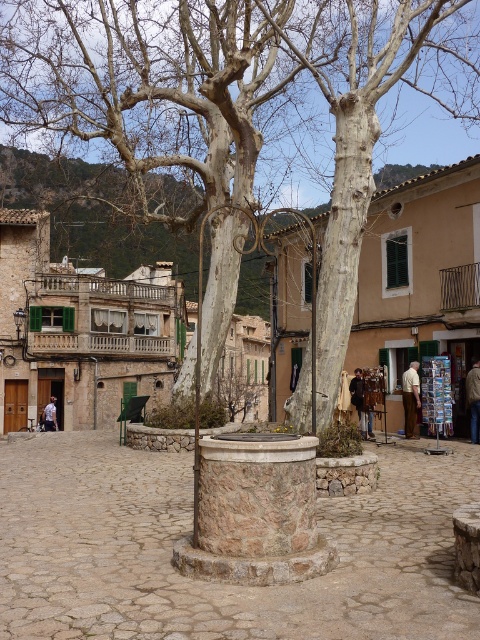
Question: Based on their relative distances, which object is nearer to the light blue denim jacket at center?

Choices:
 (A) brown leather jacket at center
 (B) smooth white tree at center

Answer: (B)

Question: Is smooth white tree at center to the left of smooth white bark at center from the viewer's perspective?

Choices:
 (A) yes
 (B) no

Answer: (A)

Question: Which object appears farthest from the camera in this image?

Choices:
 (A) smooth white bark at center
 (B) smooth white tree at center
 (C) brown leather jacket at center
 (D) dark brown leather jacket at center

Answer: (D)

Question: Which point is farther to the camera?

Choices:
 (A) (51, 406)
 (B) (362, 380)

Answer: (A)

Question: Can you confirm if smooth white bark at center is positioned to the left of light brown leather jacket at lower right?

Choices:
 (A) yes
 (B) no

Answer: (B)

Question: Where is smooth white bark at center located in relation to light blue denim jacket at center in the image?

Choices:
 (A) right
 (B) left

Answer: (A)